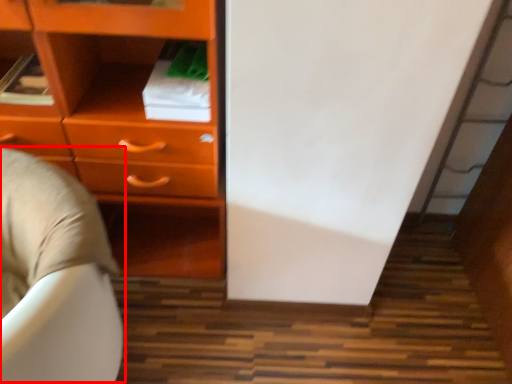
Question: Where is bean bag chair (annotated by the red box) located in relation to chest of drawers in the image?

Choices:
 (A) right
 (B) left

Answer: (B)